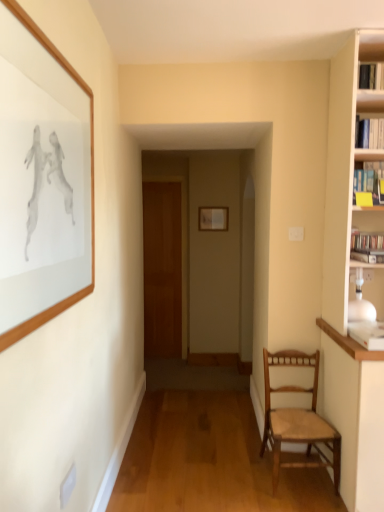
Question: From the image's perspective, is wooden door at center located above or below wooden woven seat chair at right?

Choices:
 (A) below
 (B) above

Answer: (B)

Question: In terms of size, does wooden door at center appear bigger or smaller than wooden woven seat chair at right?

Choices:
 (A) big
 (B) small

Answer: (B)

Question: Which object is positioned closest to the hardcover book at right?

Choices:
 (A) matte silver picture frame at center, the 1th picture frame viewed from the back
 (B) wooden woven seat chair at right
 (C) wooden door at center
 (D) wooden picture frame at upper left, marked as the second picture frame in a back-to-front arrangement

Answer: (B)

Question: Based on their relative distances, which object is farther from the hardcover book at right?

Choices:
 (A) matte silver picture frame at center, which is the second picture frame in front-to-back order
 (B) wooden woven seat chair at right
 (C) wooden picture frame at upper left, the first picture frame positioned from the front
 (D) wooden door at center

Answer: (D)